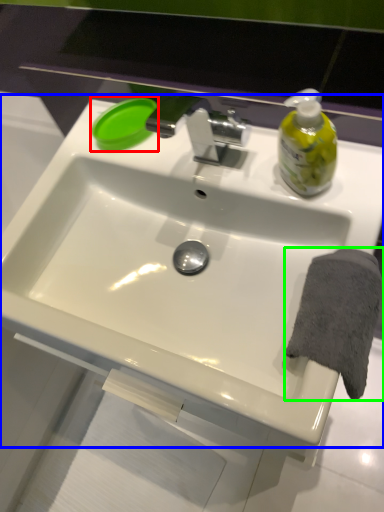
Question: Estimate the real-world distances between objects in this image. Which object is closer to soap (highlighted by a red box), sink (highlighted by a blue box) or bath towel (highlighted by a green box)?

Choices:
 (A) sink
 (B) bath towel

Answer: (A)